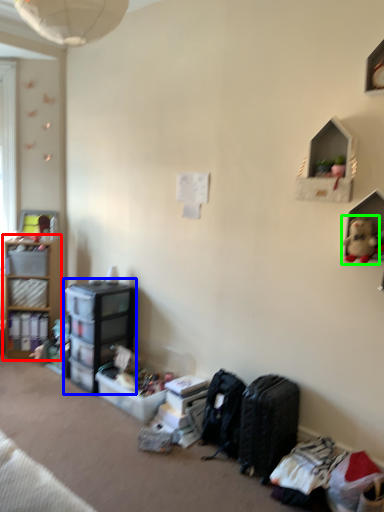
Question: Which object is positioned farthest from shelf (highlighted by a red box)? Select from shelf (highlighted by a blue box) and toy (highlighted by a green box).

Choices:
 (A) shelf
 (B) toy

Answer: (B)